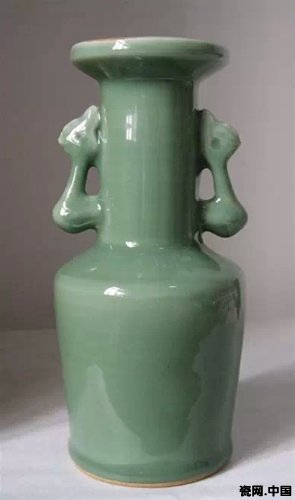
Where is `wall behind vase`? wall behind vase is located at coordinates (12, 244).